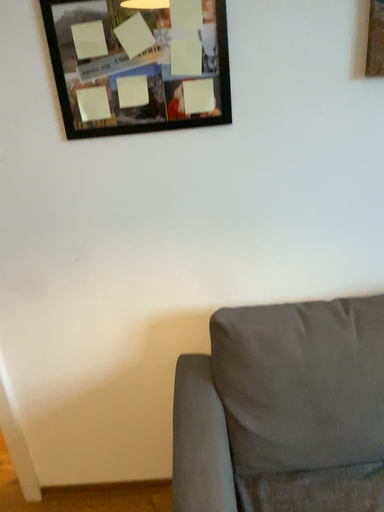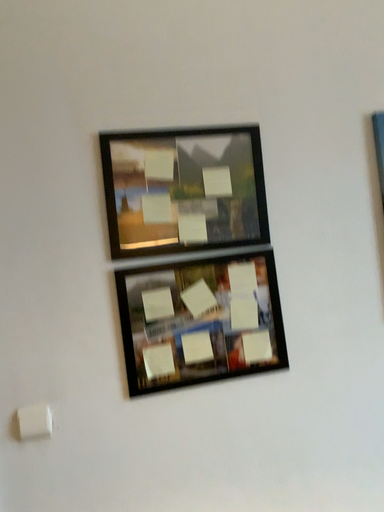
Question: How did the camera likely rotate when shooting the video?

Choices:
 (A) rotated right
 (B) rotated left

Answer: (A)